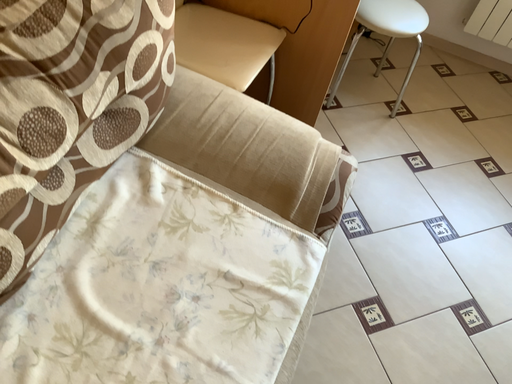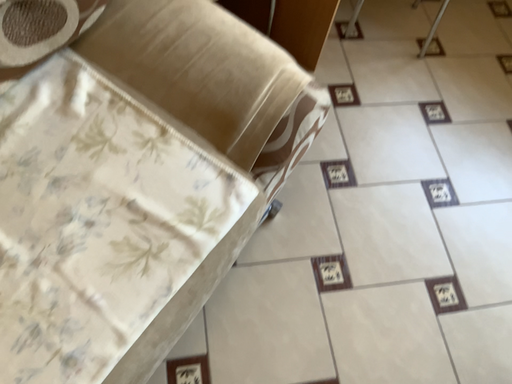
Question: How did the camera likely rotate when shooting the video?

Choices:
 (A) rotated upward
 (B) rotated downward

Answer: (B)